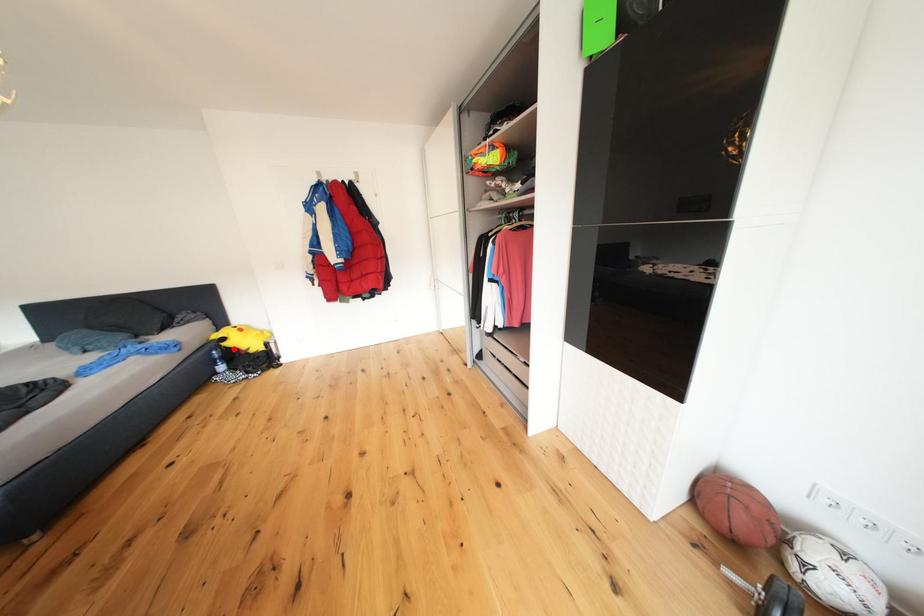
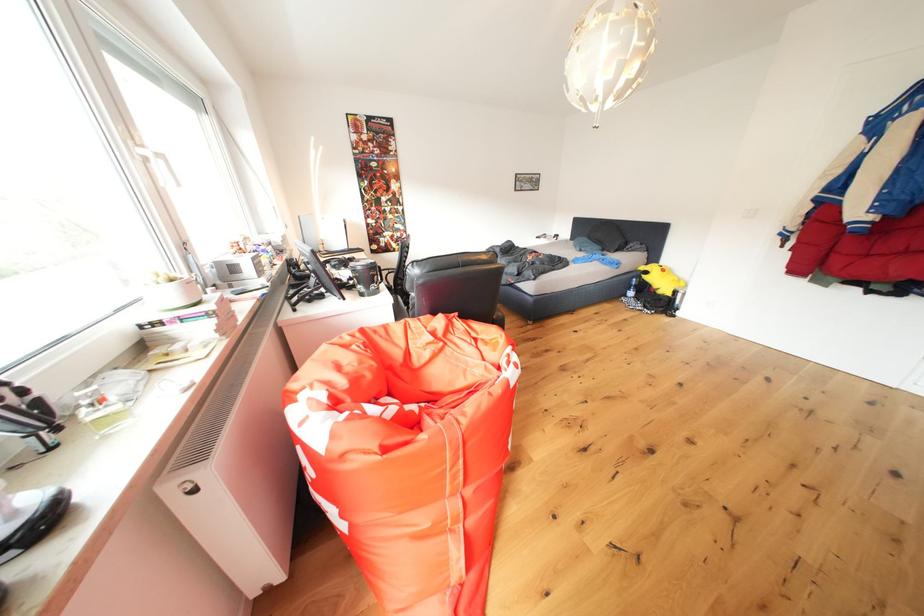
Question: I am providing you with two images of the same scene from different viewpoints. Image1 has a red point marked. In image2, the corresponding 3D location appears at what relative position? Reply with the corresponding letter.

Choices:
 (A) Closer
 (B) Farther

Answer: (B)